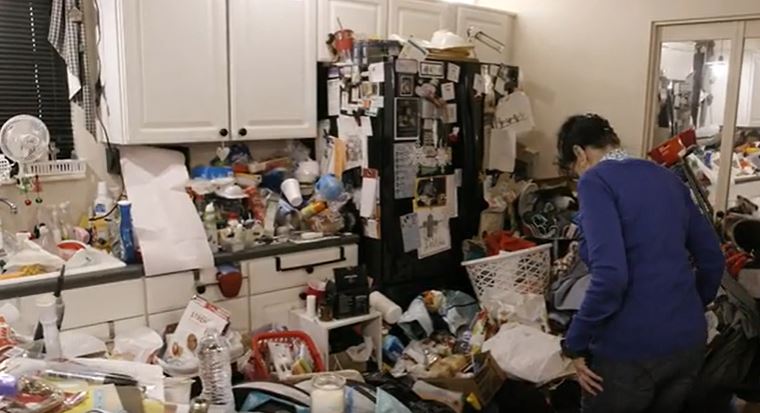
At what (x,y) coordinates should I click in order to perform the action: click on blinds. Please return your answer as a coordinate pair (x, y). Looking at the image, I should click on (23, 72).